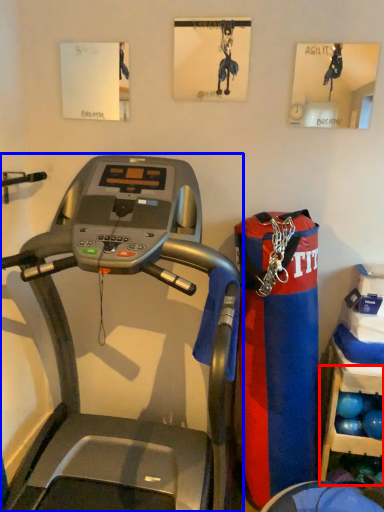
Question: Which object is further to the camera taking this photo, shelf (highlighted by a red box) or treadmill (highlighted by a blue box)?

Choices:
 (A) shelf
 (B) treadmill

Answer: (A)